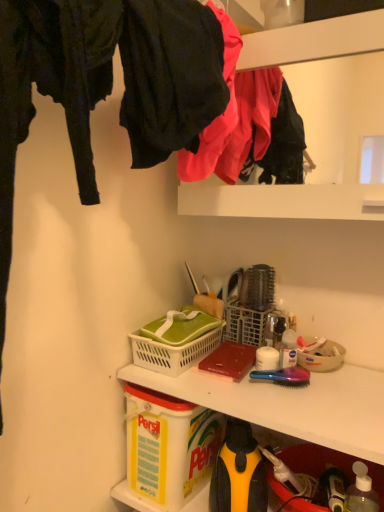
Identify the location of vacant area that is in front of white plastic picnic basket at center. The height and width of the screenshot is (512, 384). (221, 391).